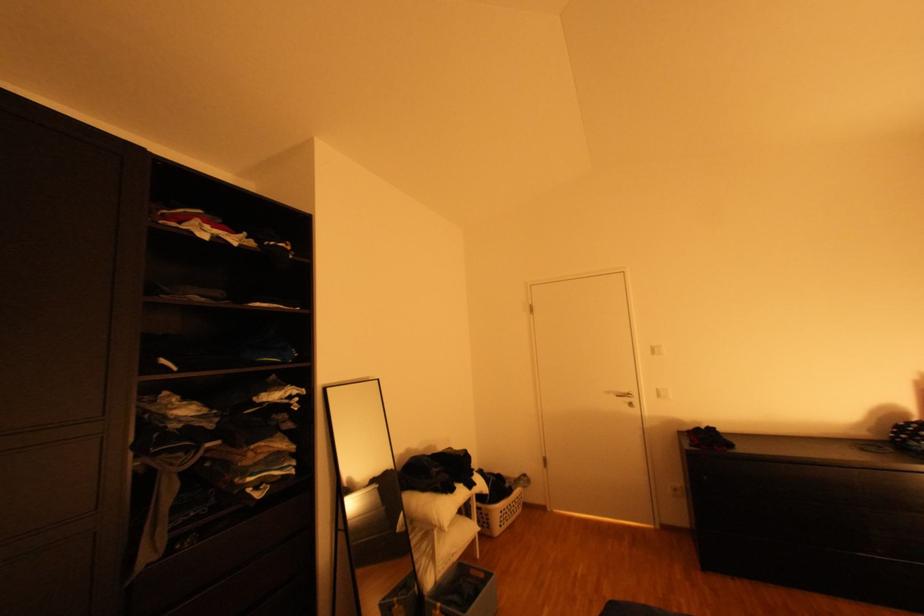
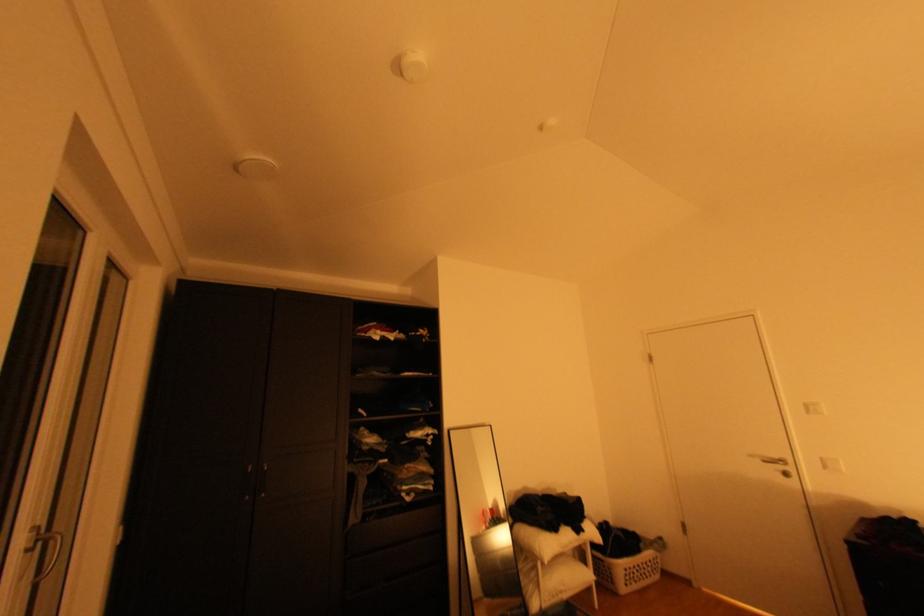
Question: The camera is either moving clockwise (left) or counter-clockwise (right) around the object. The first image is from the beginning of the video and the second image is from the end. Is the camera moving left or right when shooting the video?

Choices:
 (A) Left
 (B) Right

Answer: (B)